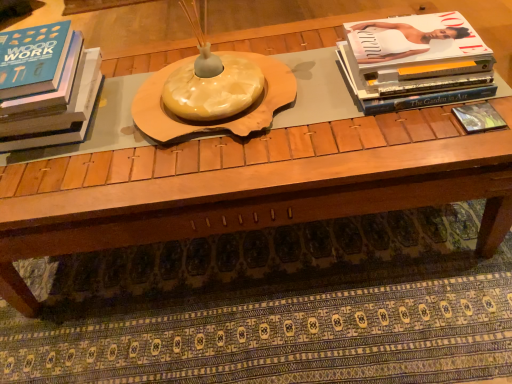
Question: Considering the relative sizes of matte white book at upper right, the second book positioned from the left, and matte black book at left, which appears as the third book when viewed from the right, in the image provided, is matte white book at upper right, the second book positioned from the left, shorter than matte black book at left, which appears as the third book when viewed from the right,?

Choices:
 (A) yes
 (B) no

Answer: (A)

Question: Is matte white book at upper right, the second book positioned from the left, directly adjacent to matte black book at left, acting as the 1th book starting from the left?

Choices:
 (A) no
 (B) yes

Answer: (A)

Question: Could you tell me if matte white book at upper right, the 2th book when ordered from right to left, is facing matte black book at left, which appears as the third book when viewed from the right?

Choices:
 (A) no
 (B) yes

Answer: (A)

Question: Is matte white book at upper right, the second book positioned from the left, to the right of matte black book at left, acting as the 1th book starting from the left, from the viewer's perspective?

Choices:
 (A) yes
 (B) no

Answer: (A)

Question: Can you confirm if matte white book at upper right, the 2th book when ordered from right to left, is wider than matte black book at left, acting as the 1th book starting from the left?

Choices:
 (A) yes
 (B) no

Answer: (B)

Question: Is matte black book at left, acting as the 1th book starting from the left, inside matte white book at upper right, the second book positioned from the left?

Choices:
 (A) yes
 (B) no

Answer: (B)

Question: Is matte black book at right, marked as the third book in a left-to-right arrangement, positioned in front of matte white book at upper right, the 2th book when ordered from right to left?

Choices:
 (A) no
 (B) yes

Answer: (B)

Question: From the image's perspective, is matte black book at right, the first book in the right-to-left sequence, beneath matte white book at upper right, the second book positioned from the left?

Choices:
 (A) yes
 (B) no

Answer: (A)

Question: Considering the relative positions of matte black book at right, the first book in the right-to-left sequence, and matte white book at upper right, the second book positioned from the left, in the image provided, is matte black book at right, the first book in the right-to-left sequence, to the right of matte white book at upper right, the second book positioned from the left, from the viewer's perspective?

Choices:
 (A) no
 (B) yes

Answer: (B)

Question: Is matte black book at right, the first book in the right-to-left sequence, turned away from matte white book at upper right, the 2th book when ordered from right to left?

Choices:
 (A) yes
 (B) no

Answer: (A)

Question: From a real-world perspective, does matte black book at right, the first book in the right-to-left sequence, stand above matte white book at upper right, the second book positioned from the left?

Choices:
 (A) yes
 (B) no

Answer: (B)

Question: Is matte black book at right, marked as the third book in a left-to-right arrangement, not within matte white book at upper right, the second book positioned from the left?

Choices:
 (A) yes
 (B) no

Answer: (A)

Question: Is matte black book at left, which appears as the third book when viewed from the right, in contact with matte black book at right, the first book in the right-to-left sequence?

Choices:
 (A) no
 (B) yes

Answer: (A)